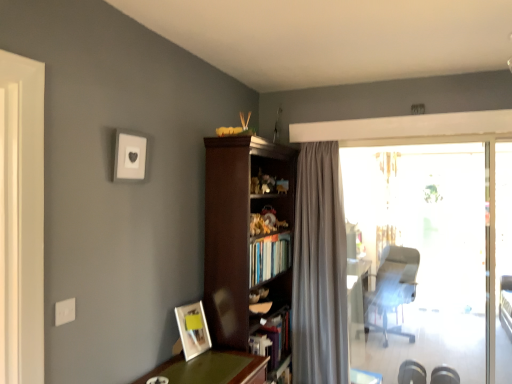
Question: From a real-world perspective, is transparent glass door at right under satin gray curtain at center?

Choices:
 (A) yes
 (B) no

Answer: (B)

Question: Can you confirm if transparent glass door at right is shorter than satin gray curtain at center?

Choices:
 (A) yes
 (B) no

Answer: (B)

Question: Is transparent glass door at right further to camera compared to satin gray curtain at center?

Choices:
 (A) yes
 (B) no

Answer: (A)

Question: Is transparent glass door at right wider than satin gray curtain at center?

Choices:
 (A) no
 (B) yes

Answer: (A)

Question: From a real-world perspective, is transparent glass door at right positioned over satin gray curtain at center based on gravity?

Choices:
 (A) yes
 (B) no

Answer: (A)

Question: Could satin gray curtain at center be considered to be inside transparent glass door at right?

Choices:
 (A) no
 (B) yes

Answer: (A)

Question: Is matte wooden picture frame at lower left, the 2th picture frame positioned from the top, to the right of dark wood bookcase at center from the viewer's perspective?

Choices:
 (A) no
 (B) yes

Answer: (A)

Question: From the image's perspective, is matte wooden picture frame at lower left, which is the 1th picture frame in back-to-front order, located beneath dark wood bookcase at center?

Choices:
 (A) no
 (B) yes

Answer: (B)

Question: Can you confirm if matte wooden picture frame at lower left, which ranks as the 1th picture frame in right-to-left order, is bigger than dark wood bookcase at center?

Choices:
 (A) yes
 (B) no

Answer: (B)

Question: Is matte wooden picture frame at lower left, the 2th picture frame positioned from the top, facing away from dark wood bookcase at center?

Choices:
 (A) yes
 (B) no

Answer: (B)

Question: From the image's perspective, is matte wooden picture frame at lower left, which ranks as the 1th picture frame in right-to-left order, on top of dark wood bookcase at center?

Choices:
 (A) no
 (B) yes

Answer: (A)

Question: From a real-world perspective, is matte wooden picture frame at lower left, the 2th picture frame positioned from the top, under dark wood bookcase at center?

Choices:
 (A) yes
 (B) no

Answer: (A)

Question: Is matte wooden picture frame at lower left, which is the 1th picture frame in back-to-front order, at the back of satin gray curtain at center?

Choices:
 (A) no
 (B) yes

Answer: (A)